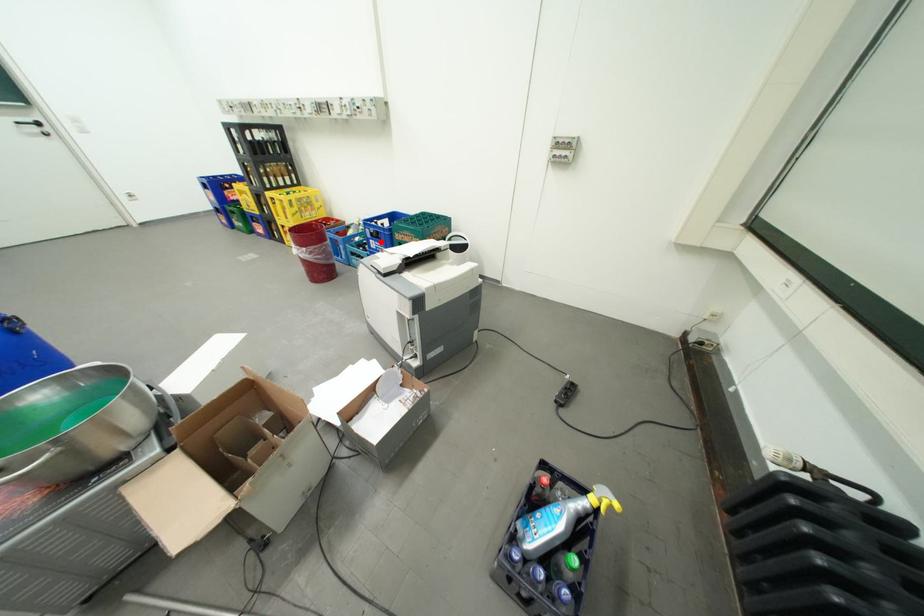
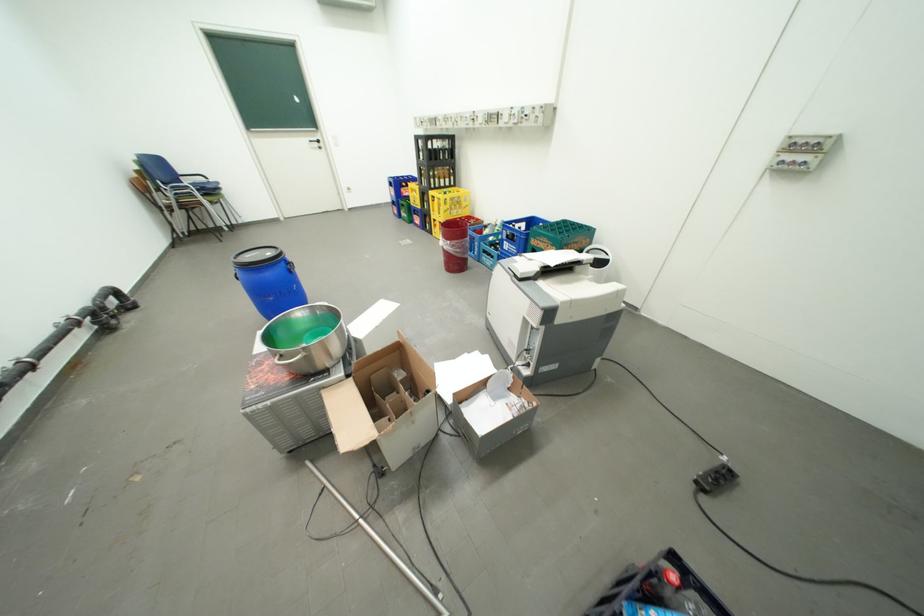
Where in the second image is the point corresponding to the highlighted location from the first image?

(516, 244)